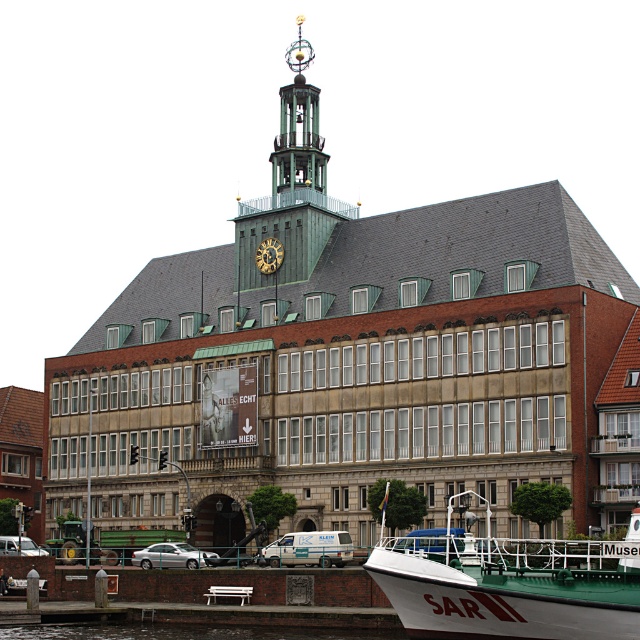
Question: Which of the following is the farthest from the observer?

Choices:
 (A) green glass bell tower at upper center
 (B) gold-plated metal clock tower at upper center
 (C) white matte sar boat at lower right
 (D) transparent water at lower center

Answer: (A)

Question: Among these points, which one is farthest from the camera?

Choices:
 (A) pos(296,170)
 (B) pos(282,145)

Answer: (A)

Question: Does gold-plated metal clock tower at upper center have a larger size compared to transparent water at lower center?

Choices:
 (A) no
 (B) yes

Answer: (B)

Question: Considering the relative positions of gold-plated metal clock tower at upper center and transparent water at lower center in the image provided, where is gold-plated metal clock tower at upper center located with respect to transparent water at lower center?

Choices:
 (A) right
 (B) left

Answer: (A)

Question: Does gold-plated metal clock tower at upper center appear under green glass bell tower at upper center?

Choices:
 (A) yes
 (B) no

Answer: (A)

Question: Which is nearer to the gold-plated metal clock tower at upper center?

Choices:
 (A) transparent water at lower center
 (B) gold metallic clock at center

Answer: (B)